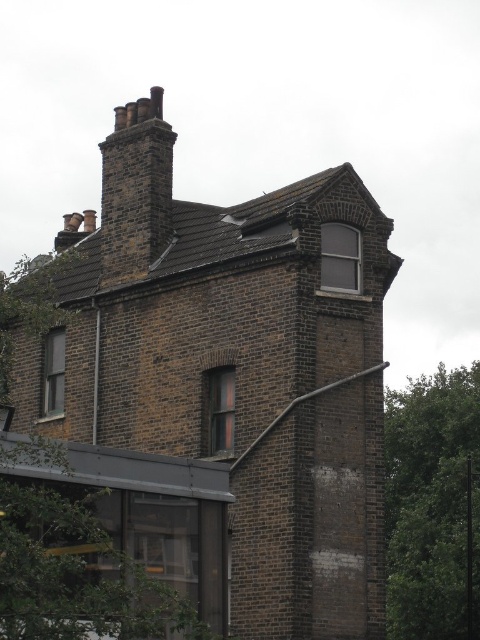
Is brown brick chimney at upper center to the right of dark brown brick chimney at upper center from the viewer's perspective?

Correct, you'll find brown brick chimney at upper center to the right of dark brown brick chimney at upper center.

Can you confirm if brown brick chimney at upper center is wider than dark brown brick chimney at upper center?

Yes.

The width and height of the screenshot is (480, 640). In order to click on brown brick chimney at upper center in this screenshot , I will do `click(226, 387)`.

Is point (444, 428) behind point (126, 259)?

Yes.

Between point (421, 442) and point (120, 259), which one is positioned behind?

The point (421, 442) is behind.

The image size is (480, 640). I want to click on green leafy tree at right, so pos(432,504).

Is point (94, 593) in front of point (115, 269)?

Yes, it is.

Is green leafy tree at left to the right of dark brown brick chimney at upper center from the viewer's perspective?

Incorrect, green leafy tree at left is not on the right side of dark brown brick chimney at upper center.

Is point (168, 525) positioned behind point (155, 173)?

No.

The height and width of the screenshot is (640, 480). Find the location of `green leafy tree at left`. green leafy tree at left is located at coordinates (113, 538).